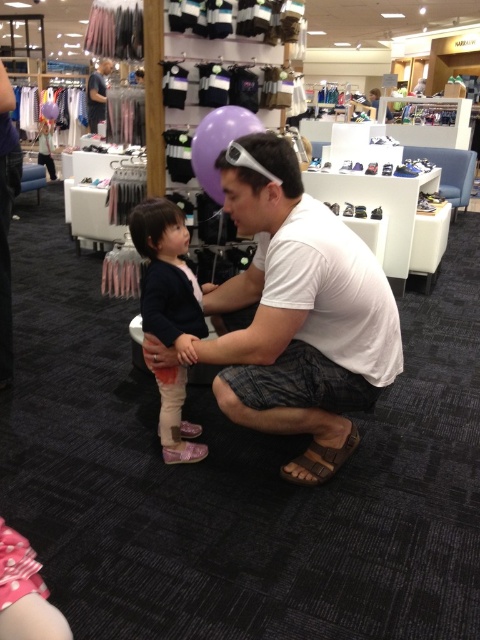
Can you confirm if white fabric shirt at center is wider than brown leather sandal at lower center?

Correct, the width of white fabric shirt at center exceeds that of brown leather sandal at lower center.

Who is positioned more to the left, white fabric shirt at center or brown leather sandal at lower center?

From the viewer's perspective, white fabric shirt at center appears more on the left side.

Where is `white fabric shirt at center`? The width and height of the screenshot is (480, 640). white fabric shirt at center is located at coordinates (299, 312).

Measure the distance between matte dark blue sweater at center and dark blue shirt at upper left.

matte dark blue sweater at center is 19.59 feet from dark blue shirt at upper left.

Between matte dark blue sweater at center and dark blue shirt at upper left, which one is positioned higher?

dark blue shirt at upper left is above.

Image resolution: width=480 pixels, height=640 pixels. What are the coordinates of `matte dark blue sweater at center` in the screenshot? It's located at (168, 276).

Which is more to the right, white fabric shirt at center or matte dark blue sweater at center?

Positioned to the right is white fabric shirt at center.

Can you confirm if white fabric shirt at center is positioned below matte dark blue sweater at center?

No, white fabric shirt at center is not below matte dark blue sweater at center.

Who is more distant from viewer, (357, 310) or (175, 328)?

Point (175, 328)

Where is `white fabric shirt at center`? white fabric shirt at center is located at coordinates (299, 312).